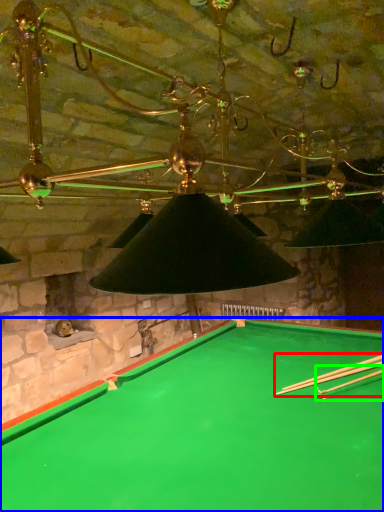
Question: Considering the real-world distances, which object is farthest from cue (highlighted by a red box)? billiard table (highlighted by a blue box) or cue (highlighted by a green box)?

Choices:
 (A) billiard table
 (B) cue

Answer: (A)